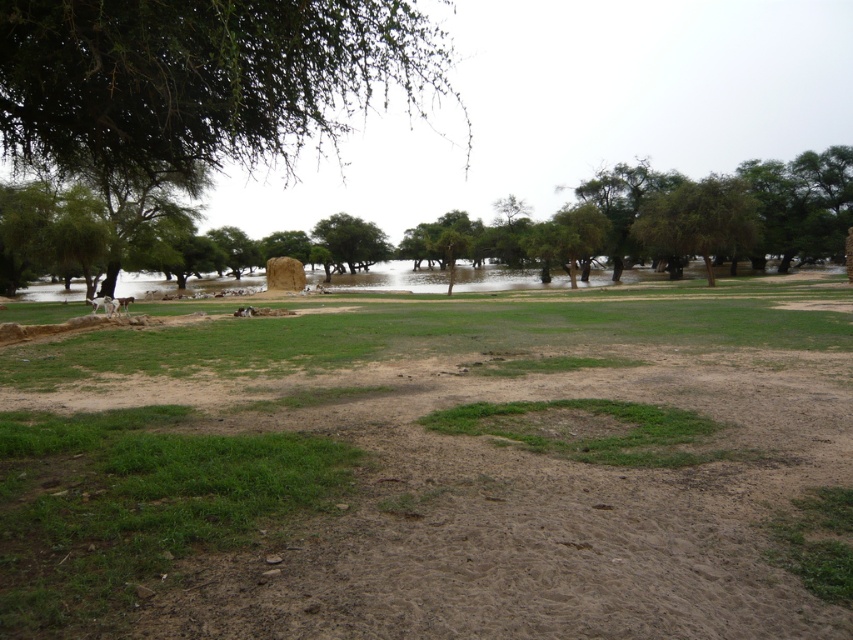
Can you confirm if brown/dry dirt field at center is positioned above green leafy tree at upper center?

No, brown/dry dirt field at center is not above green leafy tree at upper center.

Between brown/dry dirt field at center and green leafy tree at upper center, which one appears on the left side from the viewer's perspective?

brown/dry dirt field at center is more to the left.

Locate an element on the screen. brown/dry dirt field at center is located at coordinates (434, 467).

How far apart are green leafy tree at upper center and green leafy tree at center?

13.65 meters

Can you confirm if green leafy tree at upper center is taller than green leafy tree at center?

Indeed, green leafy tree at upper center has a greater height compared to green leafy tree at center.

Is point (277, 243) more distant than point (355, 225)?

No, it is in front of (355, 225).

Locate an element on the screen. The image size is (853, 640). green leafy tree at upper center is located at coordinates (664, 220).

Is point (230, 22) farther from camera compared to point (97, 300)?

No, it is in front of (97, 300).

Locate an element on the screen. green leafy tree at upper left is located at coordinates (202, 83).